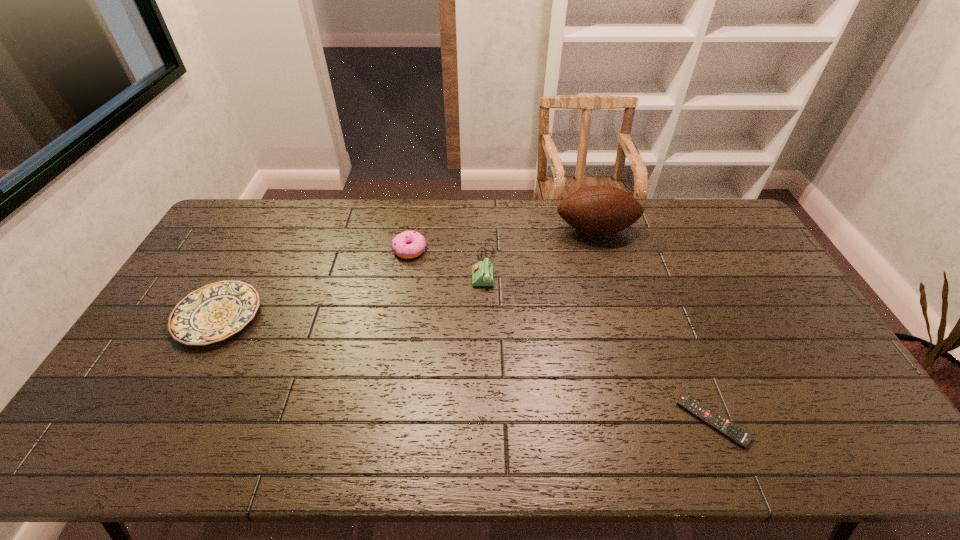
At what (x,y) coordinates should I click in order to perform the action: click on free area in between the fourth object from right to left and the fourth tallest object. Please return your answer as a coordinate pair (x, y). The image size is (960, 540). Looking at the image, I should click on tap(314, 283).

Find the location of a particular element. free space between the doughnut and the remote control is located at coordinates (561, 335).

Find the location of `object that stands as the fourth closest to the leftmost object`. object that stands as the fourth closest to the leftmost object is located at coordinates (724, 426).

The image size is (960, 540). In order to click on object that stands as the closest to the tallest object in this screenshot , I will do `click(482, 272)`.

This screenshot has width=960, height=540. What are the coordinates of `vacant space that satisfies the following two spatial constraints: 1. on the laces of the football; 2. on the right side of the remote control` in the screenshot? It's located at (652, 421).

Locate an element on the screen. blank area in the image that satisfies the following two spatial constraints: 1. on the dial of the telephone; 2. on the right side of the remote control is located at coordinates (485, 421).

The image size is (960, 540). Find the location of `vacant point that satisfies the following two spatial constraints: 1. on the dial of the third object from right to left; 2. on the right side of the remote control`. vacant point that satisfies the following two spatial constraints: 1. on the dial of the third object from right to left; 2. on the right side of the remote control is located at coordinates (485, 421).

Where is `vacant point that satisfies the following two spatial constraints: 1. on the dial of the remote control; 2. on the left side of the telephone`? vacant point that satisfies the following two spatial constraints: 1. on the dial of the remote control; 2. on the left side of the telephone is located at coordinates (485, 421).

The width and height of the screenshot is (960, 540). Identify the location of free space in the image that satisfies the following two spatial constraints: 1. on the back side of the fourth object from right to left; 2. on the left side of the fourth tallest object. (254, 249).